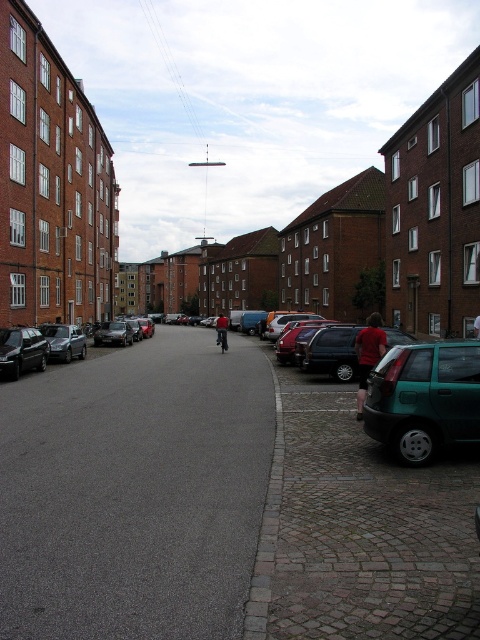
Who is positioned more to the right, red fabric shirt at right or matte silver sedan at left?

red fabric shirt at right is more to the right.

Can you confirm if red fabric shirt at right is positioned to the right of matte silver sedan at left?

Indeed, red fabric shirt at right is positioned on the right side of matte silver sedan at left.

Is point (368, 330) positioned before point (67, 342)?

Yes, it is.

Find the location of a particular element. The height and width of the screenshot is (640, 480). red fabric shirt at right is located at coordinates (368, 355).

Between matte silver sedan at left and matte black car at center, which one appears on the left side from the viewer's perspective?

From the viewer's perspective, matte black car at center appears more on the left side.

Does matte silver sedan at left appear over matte black car at center?

No, matte silver sedan at left is not above matte black car at center.

Which is in front, point (78, 332) or point (103, 332)?

Point (78, 332) is more forward.

Locate an element on the screen. The height and width of the screenshot is (640, 480). matte silver sedan at left is located at coordinates (63, 340).

Does point (49, 348) come in front of point (220, 344)?

That is True.

Image resolution: width=480 pixels, height=640 pixels. I want to click on matte silver sedan at left, so click(63, 340).

Locate an element on the screen. Image resolution: width=480 pixels, height=640 pixels. matte silver sedan at left is located at coordinates (63, 340).

I want to click on matte silver sedan at left, so click(63, 340).